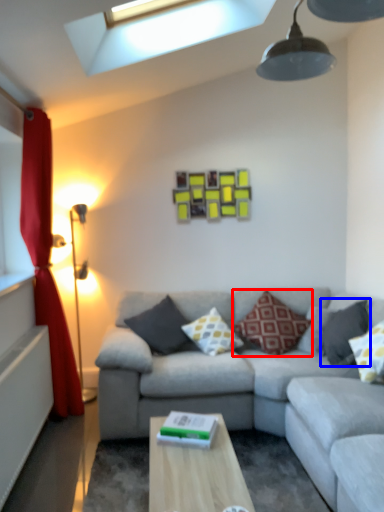
Question: Which object appears closest to the camera in this image, pillow (highlighted by a red box) or pillow (highlighted by a blue box)?

Choices:
 (A) pillow
 (B) pillow

Answer: (B)